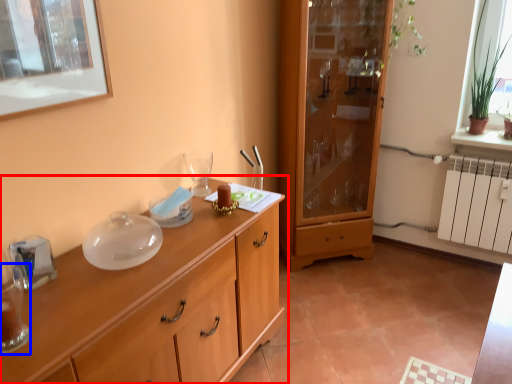
Question: Which point is closer to the camera, cupboard (highlighted by a red box) or tableware (highlighted by a blue box)?

Choices:
 (A) cupboard
 (B) tableware

Answer: (A)